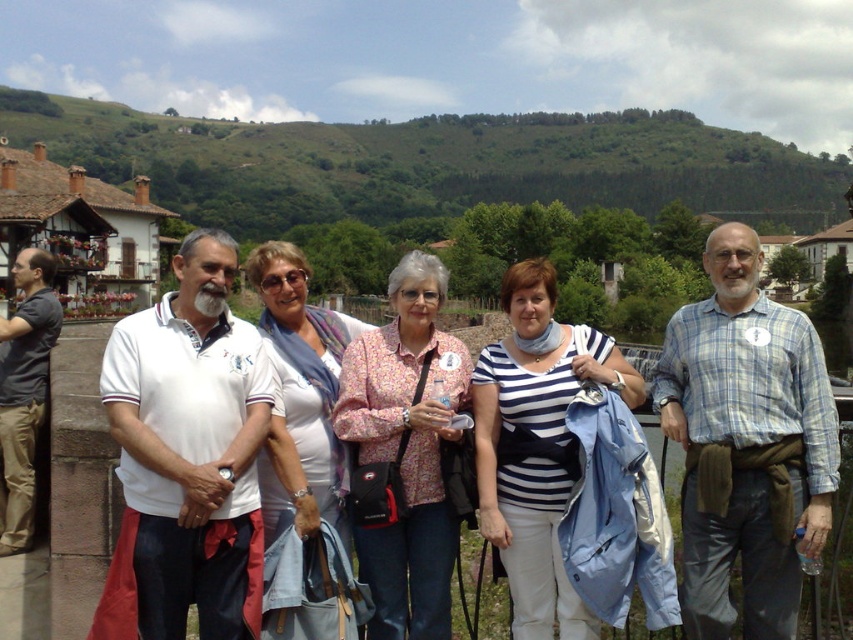
Question: In this image, where is floral print blouse at center located relative to white striped shirt at center?

Choices:
 (A) right
 (B) left

Answer: (B)

Question: Which point is farther to the camera?

Choices:
 (A) blue plaid shirt at center
 (B) white cotton shirt at center
 (C) white fabric scarf at center

Answer: (A)

Question: Can you confirm if blue plaid shirt at center is positioned above white fabric scarf at center?

Choices:
 (A) yes
 (B) no

Answer: (B)

Question: Which point is farther from the camera taking this photo?

Choices:
 (A) pos(822,461)
 (B) pos(271,516)
 (C) pos(131,476)

Answer: (B)

Question: Which object is closer to the camera taking this photo?

Choices:
 (A) white fabric scarf at center
 (B) floral print blouse at center
 (C) white cotton shirt at center
 (D) white cotton polo shirt at center

Answer: (D)

Question: Does blue plaid shirt at center come in front of white fabric scarf at center?

Choices:
 (A) yes
 (B) no

Answer: (B)